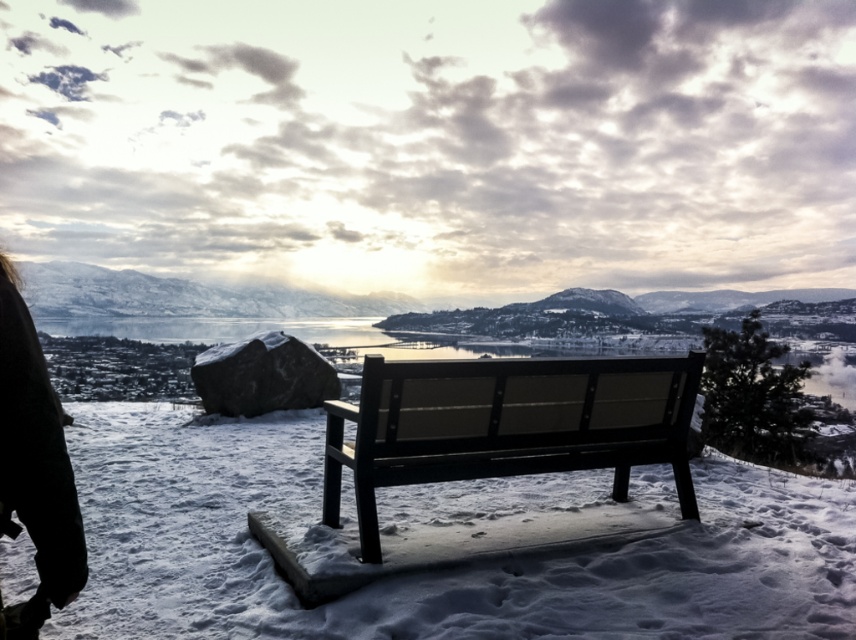
Question: Which object is positioned farthest from the white powdery snow at center?

Choices:
 (A) black fabric at lower left
 (B) matte black bench at center

Answer: (A)

Question: Does white powdery snow at center appear under matte black bench at center?

Choices:
 (A) yes
 (B) no

Answer: (A)

Question: Can you confirm if matte black bench at center is positioned above black fabric at lower left?

Choices:
 (A) yes
 (B) no

Answer: (B)

Question: Which object appears farthest from the camera in this image?

Choices:
 (A) white powdery snow at center
 (B) black fabric at lower left

Answer: (A)

Question: Which of the following is the closest to the observer?

Choices:
 (A) matte black bench at center
 (B) white powdery snow at center

Answer: (A)

Question: Can you confirm if white powdery snow at center is thinner than matte black bench at center?

Choices:
 (A) yes
 (B) no

Answer: (A)